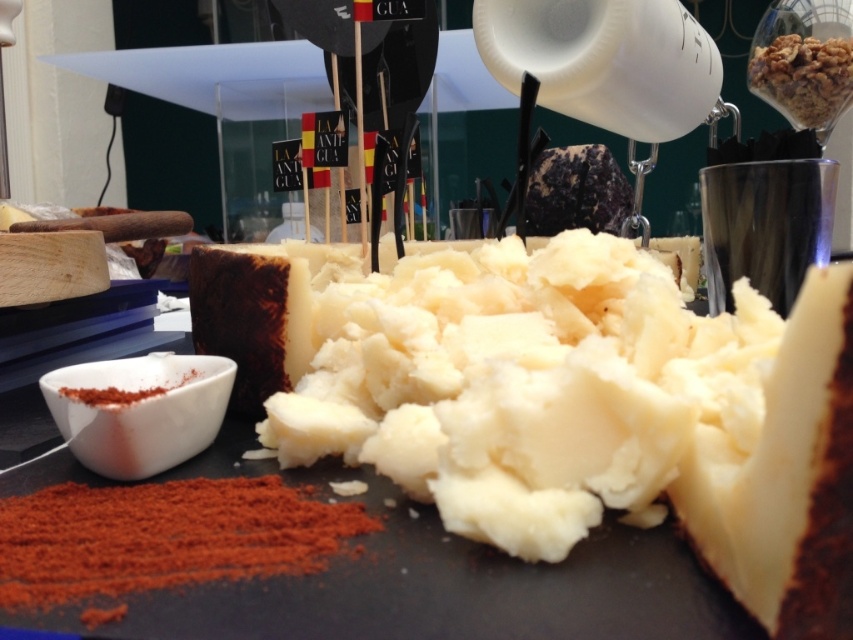
You are a chef preparing a dish and need to know the spatial relationship between the white creamy cheese at center and the red powder at lower left. Which object is wider?

The white creamy cheese at center is wider than the red powder at lower left.

You are a food stylist arranging a dish. You have the crumbly brown nuts at upper right and the red powder at lower left. Which item is positioned higher on the plate?

The crumbly brown nuts at upper right are positioned higher on the plate than the red powder at lower left.

You are a food stylist arranging ingredients on a plate. You have the white creamy cheese at center and the crumbly brown nuts at upper right. Based on their positions and sizes, which ingredient occupies more horizontal space on the plate?

The white creamy cheese at center might be wider than crumbly brown nuts at upper right, so it likely occupies more horizontal space on the plate.